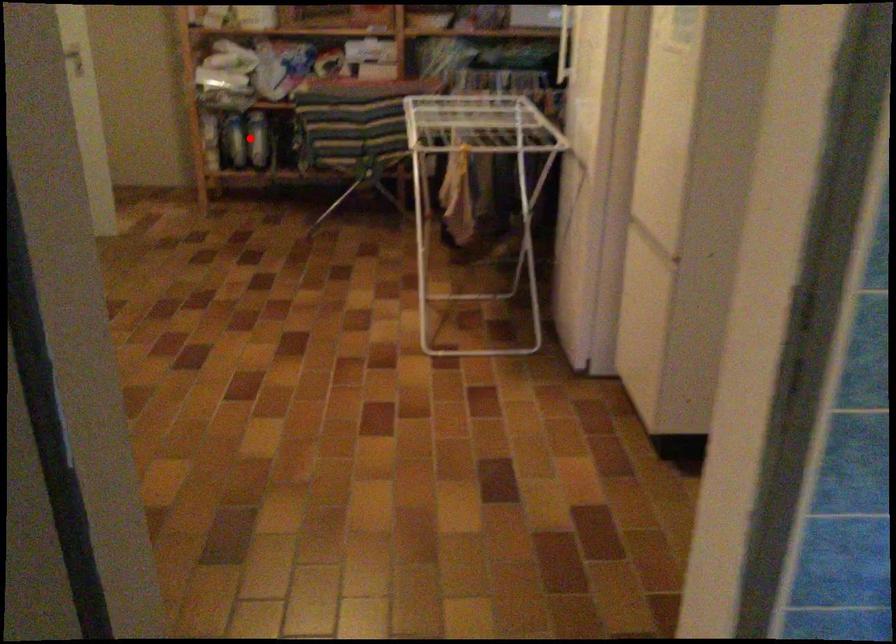
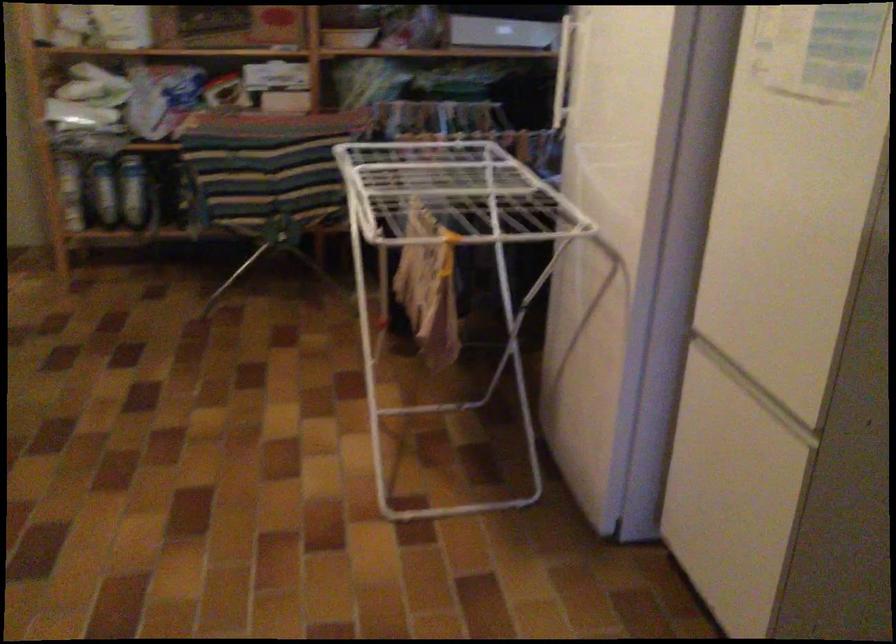
Locate, in the second image, the point that corresponds to the highlighted location in the first image.

(133, 191)